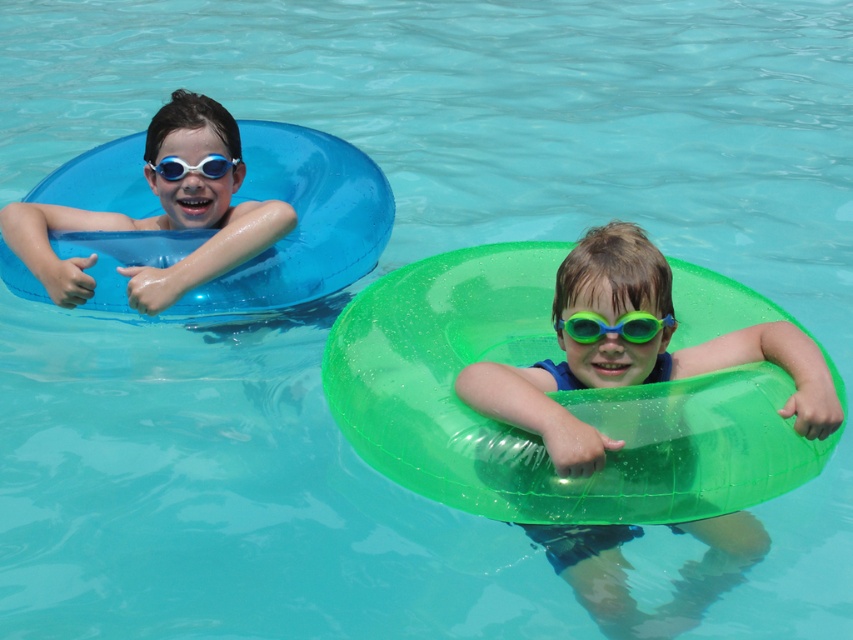
Can you confirm if green translucent tube at right is positioned above matte blue swim ring at left?

Incorrect, green translucent tube at right is not positioned above matte blue swim ring at left.

Is green translucent tube at right further to the viewer compared to matte blue swim ring at left?

No, green translucent tube at right is in front of matte blue swim ring at left.

Between point (695, 618) and point (256, 205), which one is positioned in front?

Point (695, 618)

Identify the location of green translucent tube at right. (633, 353).

Is green rubber goggles at center closer to the viewer compared to blue rubber goggles at left?

Yes, green rubber goggles at center is closer to the viewer.

Between green rubber goggles at center and blue rubber goggles at left, which one has less height?

With less height is green rubber goggles at center.

This screenshot has height=640, width=853. Identify the location of green rubber goggles at center. (614, 324).

Where is `green rubber goggles at center`? This screenshot has height=640, width=853. green rubber goggles at center is located at coordinates (614, 324).

Which is more to the left, matte blue swim ring at left or blue rubber goggles at left?

matte blue swim ring at left

Between matte blue swim ring at left and blue rubber goggles at left, which one has more height?

Standing taller between the two is matte blue swim ring at left.

Find the location of a particular element. The width and height of the screenshot is (853, 640). matte blue swim ring at left is located at coordinates (160, 214).

Locate an element on the screen. This screenshot has height=640, width=853. matte blue swim ring at left is located at coordinates (160, 214).